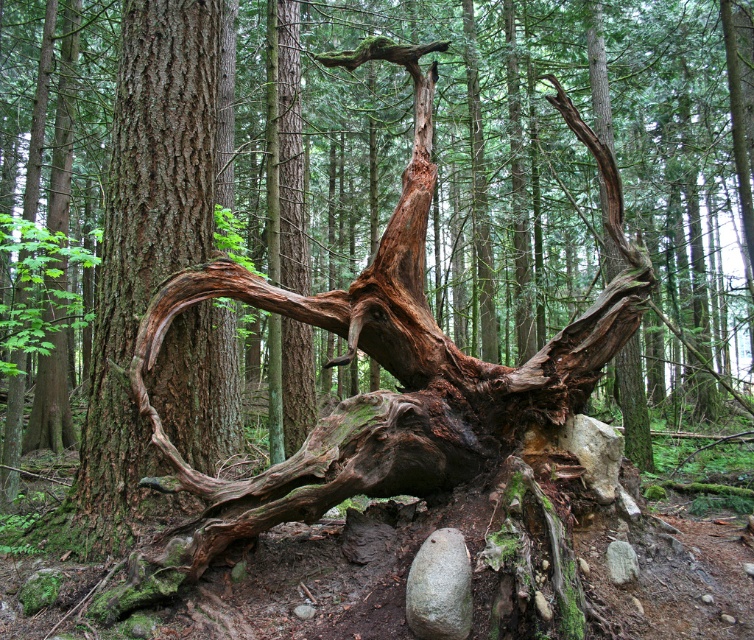
Based on the scene description, where is the rough bark tree trunk at center located in the image?

The rough bark tree trunk at center is located at point (143, 253).

You are a hiker trying to navigate through the forest. You see the rough bark tree trunk at center and the gray rough rock at lower center. Which object is higher up in the scene?

The rough bark tree trunk at center is located above the gray rough rock at lower center, so the rough bark tree trunk at center is higher up in the scene.